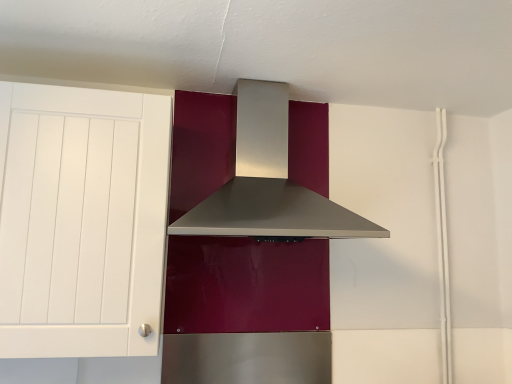
Question: From the image's perspective, is satin silver range hood at center located above or below white matte cabinet at left?

Choices:
 (A) above
 (B) below

Answer: (A)

Question: Visually, is satin silver range hood at center positioned to the left or to the right of white matte cabinet at left?

Choices:
 (A) left
 (B) right

Answer: (B)

Question: From a real-world perspective, is satin silver range hood at center above or below white matte cabinet at left?

Choices:
 (A) below
 (B) above

Answer: (B)

Question: Considering the positions of point (55, 264) and point (233, 225), is point (55, 264) closer or farther from the camera than point (233, 225)?

Choices:
 (A) closer
 (B) farther

Answer: (B)

Question: Relative to satin silver range hood at center, is white matte cabinet at left in front or behind?

Choices:
 (A) behind
 (B) front

Answer: (B)

Question: Do you think white matte cabinet at left is within satin silver range hood at center, or outside of it?

Choices:
 (A) outside
 (B) inside

Answer: (A)

Question: Would you say white matte cabinet at left is to the left or to the right of satin silver range hood at center in the picture?

Choices:
 (A) left
 (B) right

Answer: (A)